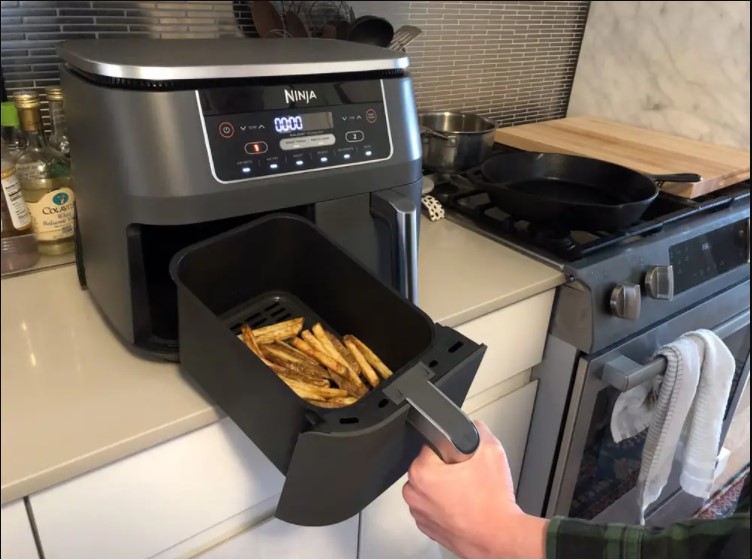
Where is `stovetop`? Image resolution: width=752 pixels, height=560 pixels. stovetop is located at coordinates (575, 242).